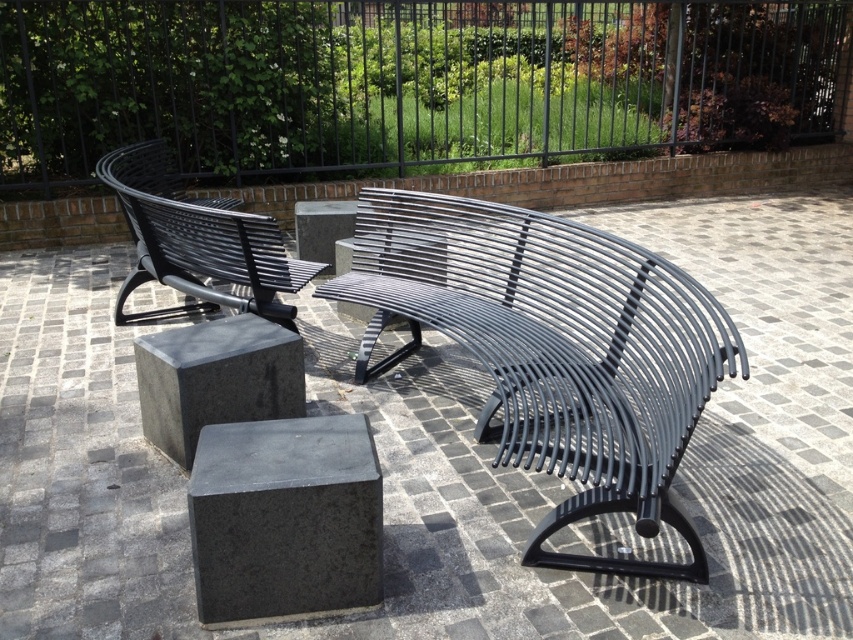
You are standing at the entrance of the outdoor seating area and want to place a potted plant exactly at the center of the gray concrete block at center. According to the coordinates provided, where should you position the plant?

The gray concrete block at center is located at point (x=285, y=518), so you should position the plant exactly at those coordinates to place it at the center of the block.

You are a visitor sitting on the black metal bench and want to place your bag on the nearest concrete surface. Which one should you choose between the gray concrete block at center and the gray polished concrete at center?

The gray concrete block at center is to the right of gray polished concrete at center, so depending on your position, if you are sitting on the bench facing the blocks, the gray polished concrete at center is directly in front and closer, making it the nearest option.

You are standing at the center of the paved area and want to place a new decorative item exactly at the center of the gray granite cube at center. Where should you place it?

The gray granite cube at center is already positioned at point (450, 458), so you should place the new decorative item exactly at that coordinate to be at its center.